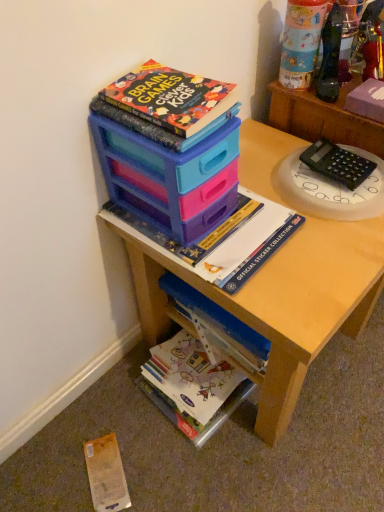
Find the location of a particular element. vacant area that is in front of black plastic calculator at upper right is located at coordinates (331, 241).